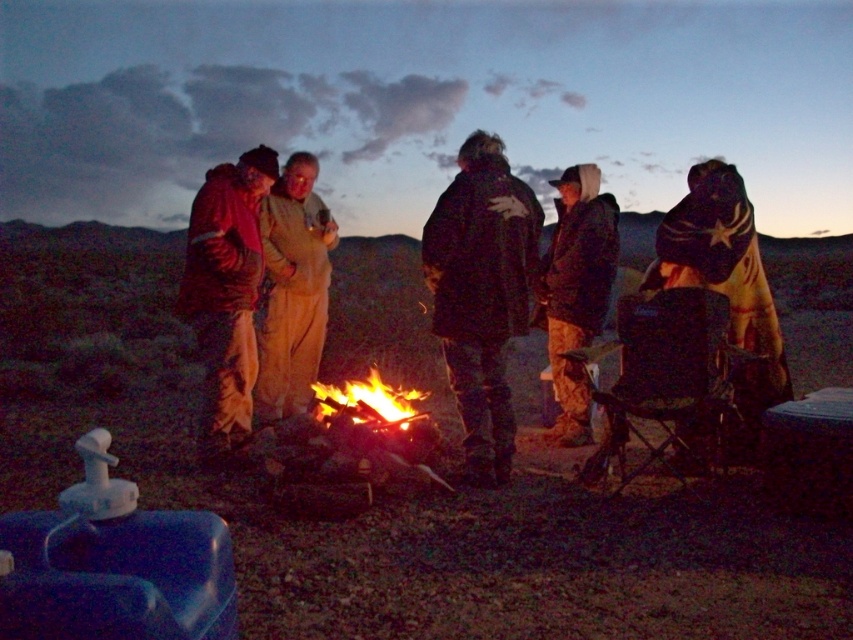
You are a photographer trying to capture a closeup of the dark brown leather jacket at center and the flaming wood at center in the scene. Your camera can only focus on objects within a 30 inch range. Can you capture both in a single shot without moving the camera?

The dark brown leather jacket at center and flaming wood at center are 33.84 inches apart from each other. Since the distance between them exceeds the camera focus range of 30 inches, you cannot capture both in a single shot without moving the camera.

Looking at the scene, where is the dark brown leather jacket at center in relation to the flaming wood at center?

The dark brown leather jacket at center is to the right of the flaming wood at center.